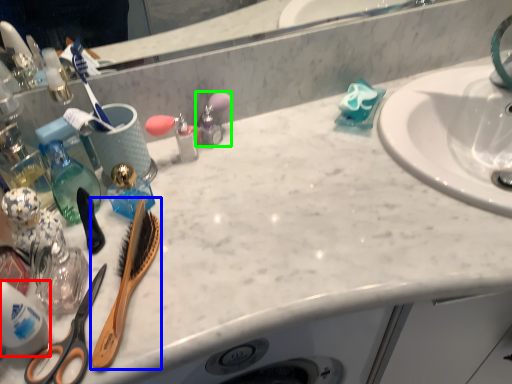
Question: Estimate the real-world distances between objects in this image. Which object is closer to cleaning product (highlighted by a red box), brush (highlighted by a blue box) or toiletry (highlighted by a green box)?

Choices:
 (A) brush
 (B) toiletry

Answer: (A)